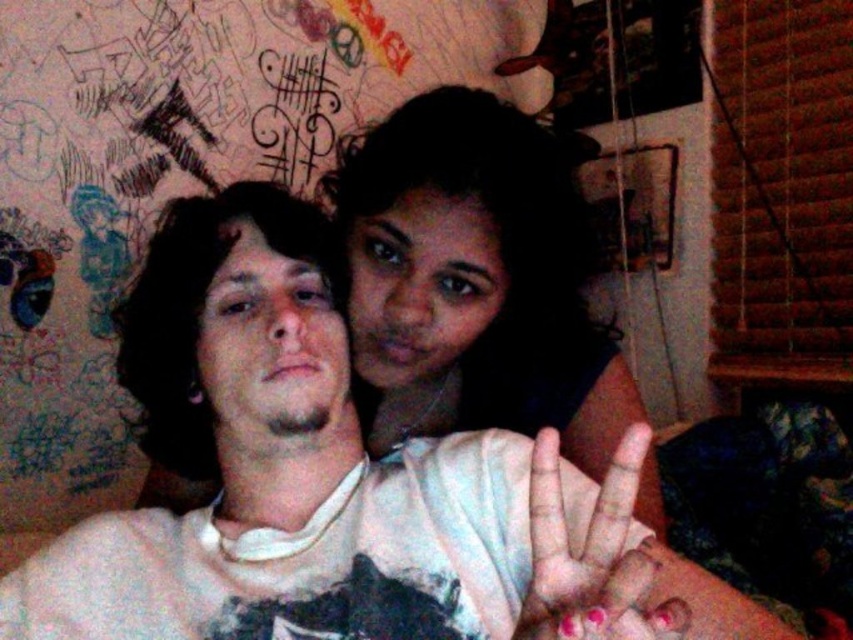
Question: Can you confirm if smooth skin face at center is positioned above pink painted nails at center?

Choices:
 (A) no
 (B) yes

Answer: (B)

Question: Among these points, which one is nearest to the camera?

Choices:
 (A) (541, 563)
 (B) (479, 339)

Answer: (A)

Question: Estimate the real-world distances between objects in this image. Which object is farther from the smooth skin face at center?

Choices:
 (A) pink painted nails at center
 (B) white cotton shirt at center

Answer: (A)

Question: Which of these objects is positioned closest to the white cotton shirt at center?

Choices:
 (A) smooth skin face at center
 (B) pink painted nails at center

Answer: (B)

Question: Can you confirm if smooth skin face at center is positioned to the right of pink painted nails at center?

Choices:
 (A) yes
 (B) no

Answer: (B)

Question: Is white cotton shirt at center bigger than pink painted nails at center?

Choices:
 (A) no
 (B) yes

Answer: (B)